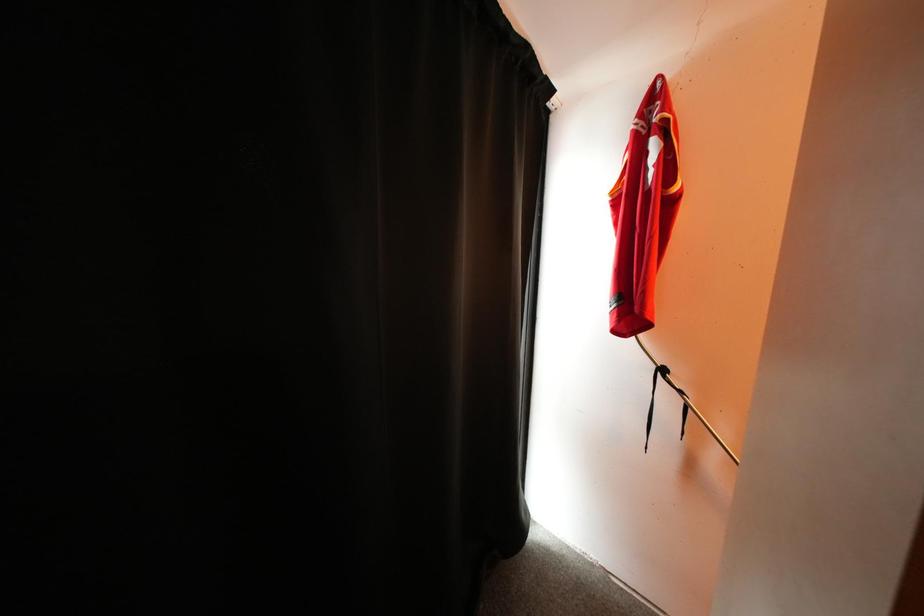
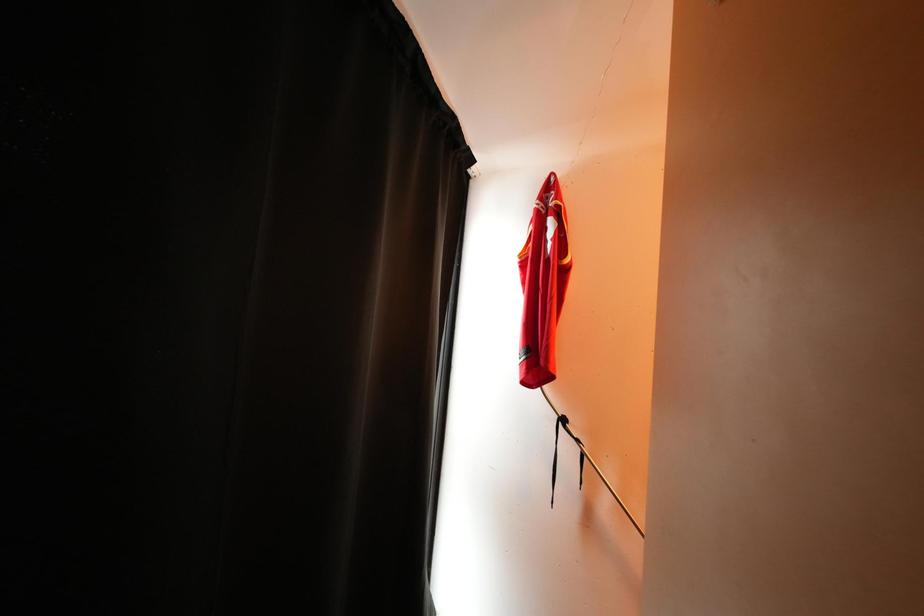
Question: In a continuous first-person perspective shot, in which direction is the camera moving?

Choices:
 (A) Left
 (B) Right
 (C) Forward
 (D) Backward

Answer: (C)